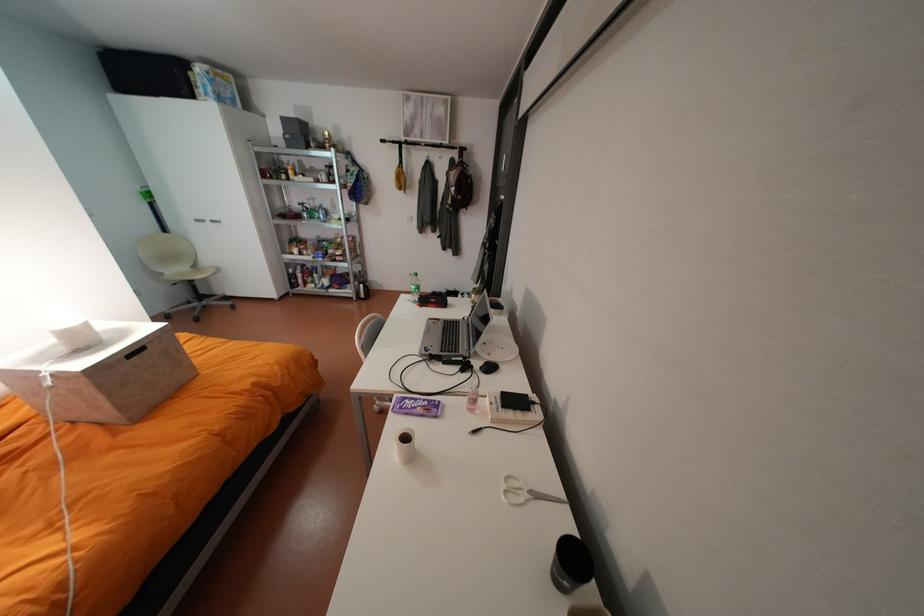
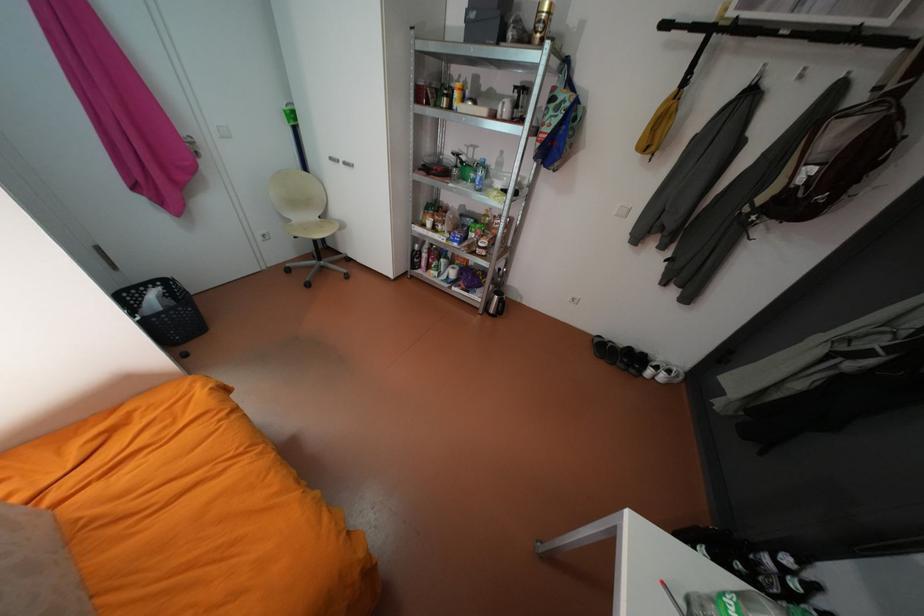
Where in the second image is the point corresponding to the point at 403,140 from the first image?

(703, 26)